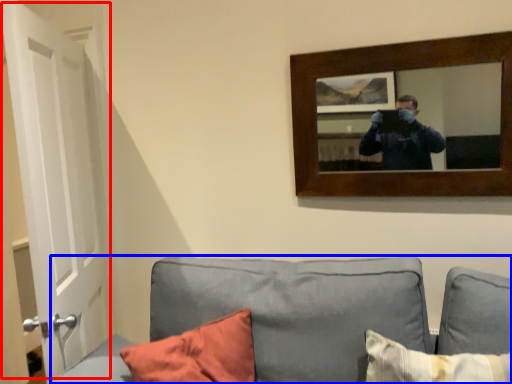
Question: Which object is further to the camera taking this photo, door (highlighted by a red box) or studio couch (highlighted by a blue box)?

Choices:
 (A) door
 (B) studio couch

Answer: (A)